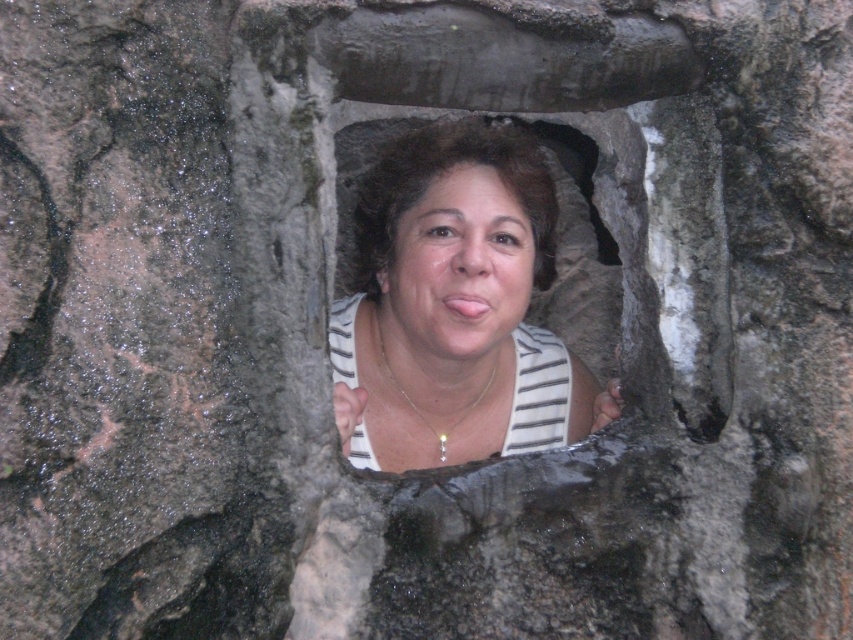
Who is shorter, matte white tank top at center or matte white face at center?

Standing shorter between the two is matte white face at center.

Does matte white tank top at center appear on the right side of matte white face at center?

No, matte white tank top at center is not to the right of matte white face at center.

This screenshot has height=640, width=853. What are the coordinates of `matte white tank top at center` in the screenshot? It's located at (457, 307).